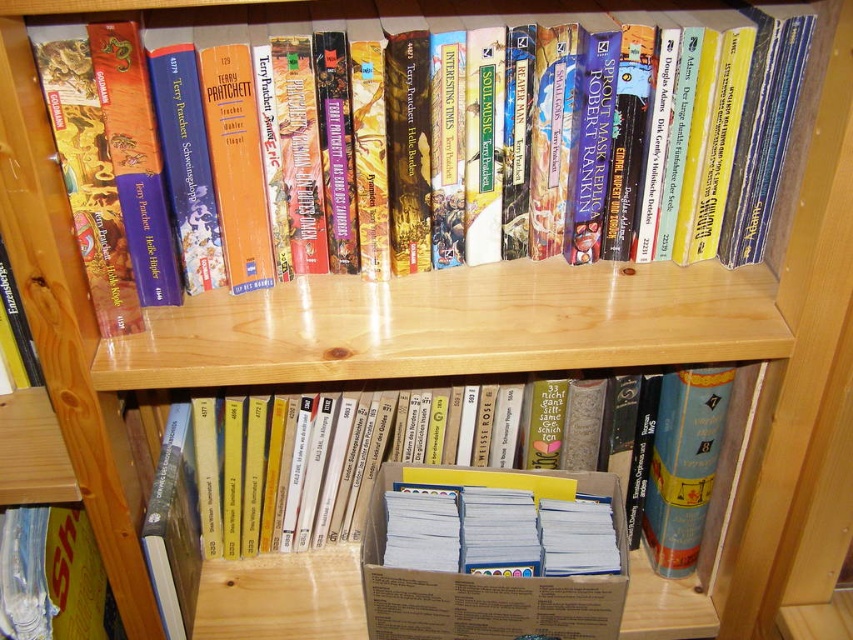
Who is more forward, [252,609] or [741,100]?

Point [741,100] is in front.

Which of these two, brown cardboard box at center or hardcover book at upper center, stands taller?

brown cardboard box at center

In order to click on brown cardboard box at center in this screenshot , I will do `click(282, 596)`.

Find the location of a particular element. The image size is (853, 640). brown cardboard box at center is located at coordinates (282, 596).